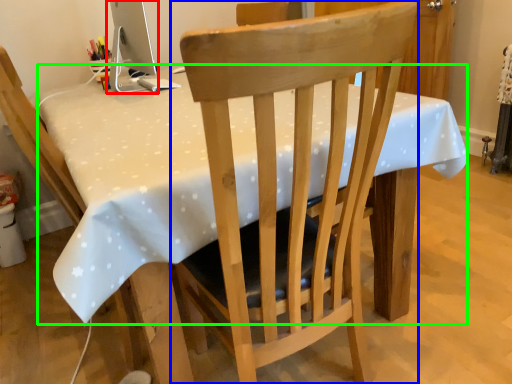
Question: Estimate the real-world distances between objects in this image. Which object is closer to computer monitor (highlighted by a red box), chair (highlighted by a blue box) or table (highlighted by a green box)?

Choices:
 (A) chair
 (B) table

Answer: (B)